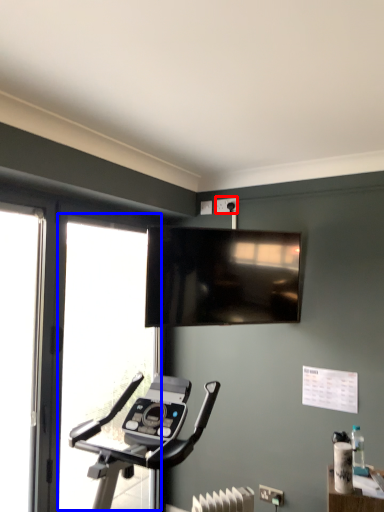
Question: Which object appears closest to the camera in this image, electric outlet (highlighted by a red box) or window (highlighted by a blue box)?

Choices:
 (A) electric outlet
 (B) window

Answer: (B)